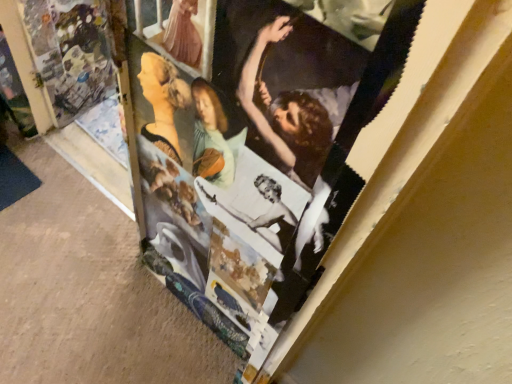
Describe the element at coordinates (252, 143) in the screenshot. The height and width of the screenshot is (384, 512). I see `matte black paperback book at center` at that location.

Where is `matte black paperback book at center`? The image size is (512, 384). matte black paperback book at center is located at coordinates (252, 143).

The image size is (512, 384). What are the coordinates of `matte black paperback book at center` in the screenshot? It's located at (252, 143).